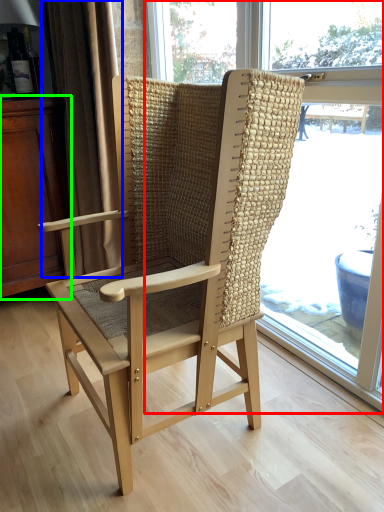
Question: Which is nearer to the window (highlighted by a red box)? curtain (highlighted by a blue box) or dresser (highlighted by a green box).

Choices:
 (A) curtain
 (B) dresser

Answer: (A)